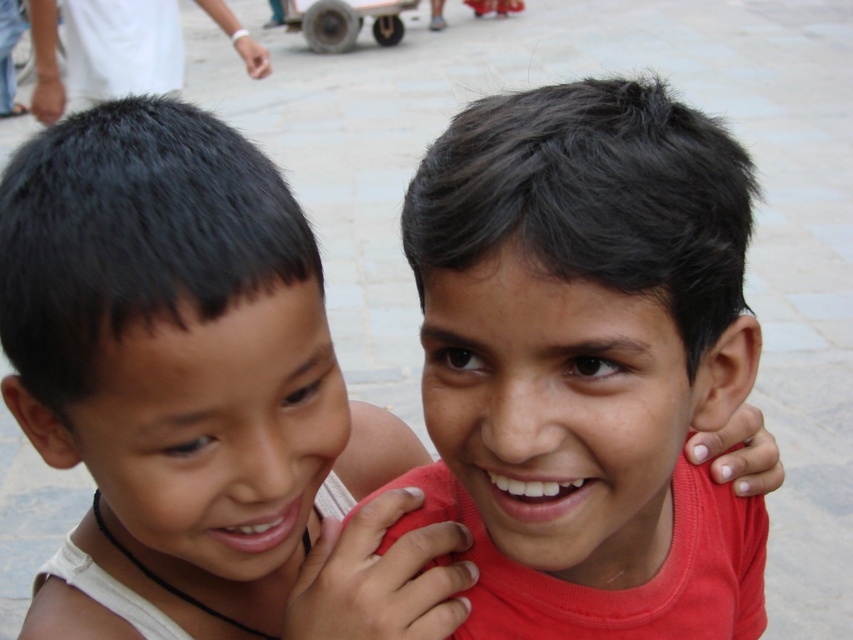
You are a photographer trying to capture both the smooth skin boy at left and the dark hair at upper left in the same frame. Based on their heights, which one should you focus on to ensure both are fully visible in the photo?

The smooth skin boy at left is shorter than dark hair at upper left, so focusing on the taller dark hair at upper left will ensure both are fully visible in the photo.

Based on the photo, you are a photographer trying to capture a candid shot of the two boys. The camera you are using has a depth sensor that can measure distances. You notice a point labeled as point (717,339) in your viewfinder. If the minimum focus distance for your camera is 30 inches, will this point be in focus?

The distance of point (717,339) from the camera is 28.74 inches, which is less than the minimum focus distance of 30 inches. Therefore, this point will not be in focus.

You are a photographer trying to capture a candid shot of the two boys. You need to ensure that the matte red shirt at center and the dark hair at upper left are both visible in the frame. Based on their positions, which object should you focus on first to ensure both are in the shot?

The matte red shirt at center is positioned under dark hair at upper left, so focusing on the dark hair at upper left first will ensure both are in the frame since the matte red shirt at center is below it.